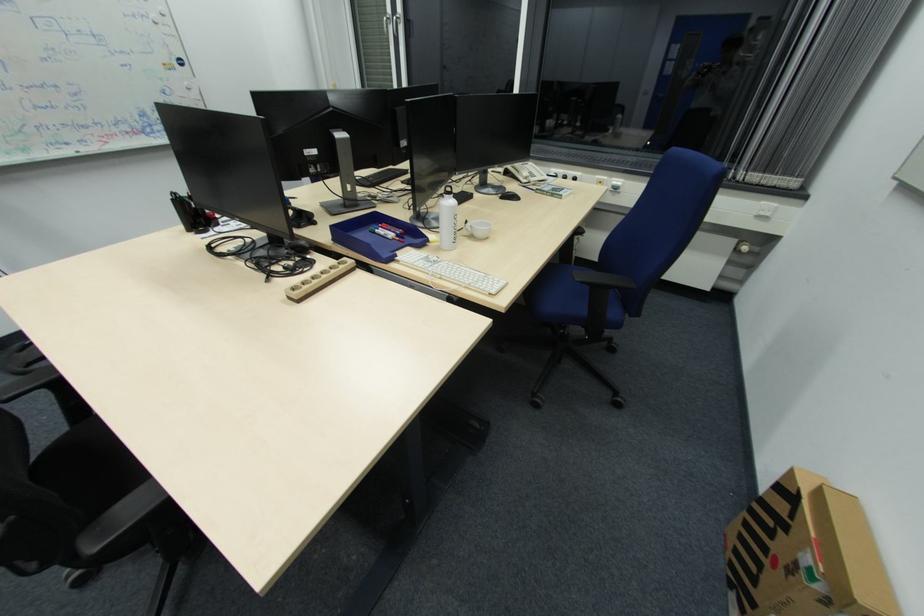
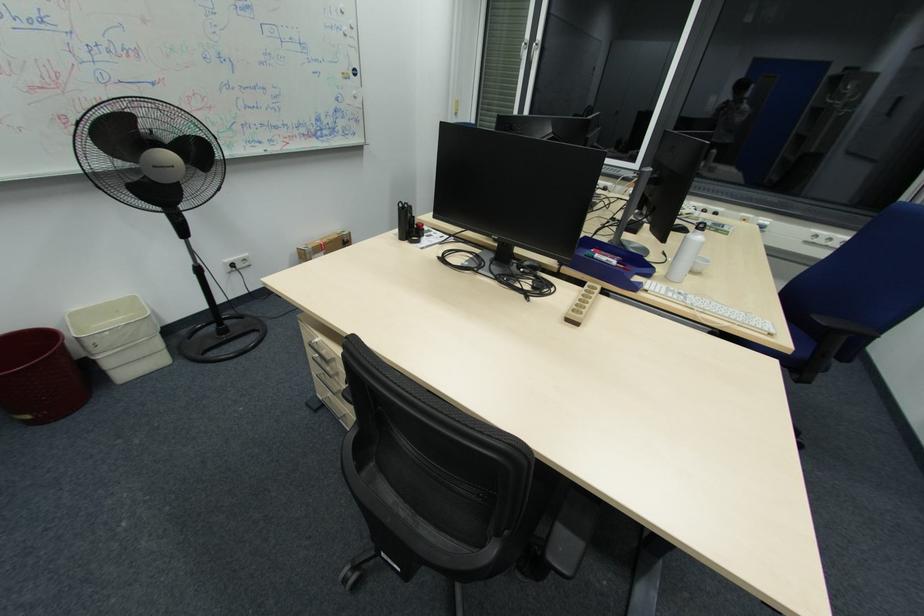
Question: Based on the continuous images, in which direction is the camera rotating? Reply with the corresponding letter.

Choices:
 (A) Left
 (B) Right
 (C) Up
 (D) Down

Answer: (C)